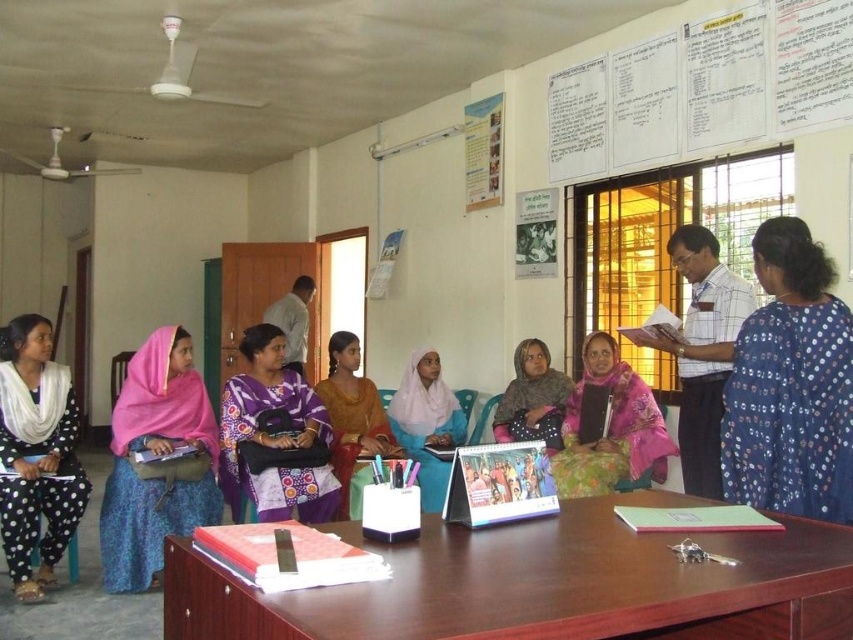
Locate an element on the screen. The height and width of the screenshot is (640, 853). blue dotted saree at right is located at coordinates (790, 385).

Does blue dotted saree at right appear on the right side of matte pink scarf at center?

Yes, blue dotted saree at right is to the right of matte pink scarf at center.

This screenshot has height=640, width=853. What are the coordinates of `blue dotted saree at right` in the screenshot? It's located at (790, 385).

Which of these two, pink fabric headscarf at left or pink fabric scarf at center, stands shorter?

pink fabric scarf at center

Can you confirm if pink fabric headscarf at left is positioned to the left of pink fabric scarf at center?

Correct, you'll find pink fabric headscarf at left to the left of pink fabric scarf at center.

Does point (158, 417) come in front of point (656, 422)?

Yes.

Find the location of a particular element. Image resolution: width=853 pixels, height=640 pixels. pink fabric headscarf at left is located at coordinates (160, 452).

Can you confirm if pink fabric headscarf at left is positioned below purple printed dress at center?

Correct, pink fabric headscarf at left is located below purple printed dress at center.

In order to click on pink fabric headscarf at left in this screenshot , I will do `click(160, 452)`.

The image size is (853, 640). In order to click on pink fabric headscarf at left in this screenshot , I will do `click(160, 452)`.